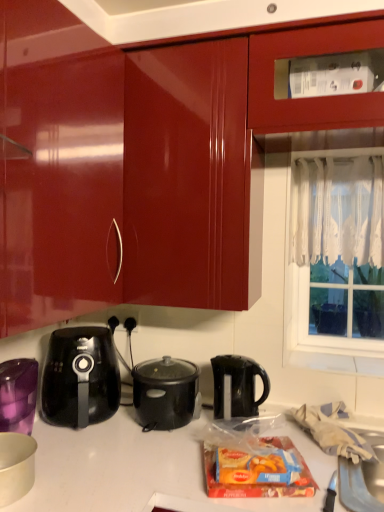
Image resolution: width=384 pixels, height=512 pixels. I want to click on white lace curtain at right, so click(x=334, y=252).

The height and width of the screenshot is (512, 384). Identify the location of matte plastic cereal at lower center. (259, 484).

This screenshot has height=512, width=384. What are the coordinates of `white matte bowl at lower left, which is counted as the 2th kitchen appliance, starting from the back` in the screenshot? It's located at (x=16, y=466).

The width and height of the screenshot is (384, 512). I want to click on black plastic kettle at center, the 1th kettle in the right-to-left sequence, so click(x=238, y=384).

What are the coordinates of `black plastic kettle at lower left, acting as the first kettle starting from the left` in the screenshot? It's located at click(80, 377).

How much distance is there between black plastic kettle at lower left, acting as the first kettle starting from the left, and black plastic kettle at center, the 1th kettle in the right-to-left sequence?

black plastic kettle at lower left, acting as the first kettle starting from the left, is 18.43 inches away from black plastic kettle at center, the 1th kettle in the right-to-left sequence.

Which object is further away from the camera taking this photo, black plastic kettle at lower left, acting as the first kettle starting from the left, or black plastic kettle at center, which is counted as the second kettle, starting from the left?

Positioned behind is black plastic kettle at center, which is counted as the second kettle, starting from the left.

Between black plastic kettle at lower left, acting as the first kettle starting from the left, and black plastic kettle at center, which is counted as the second kettle, starting from the left, which one has smaller width?

black plastic kettle at center, which is counted as the second kettle, starting from the left, is thinner.

The width and height of the screenshot is (384, 512). Find the location of `kettle on the right of black plastic kettle at lower left, the second kettle positioned from the right`. kettle on the right of black plastic kettle at lower left, the second kettle positioned from the right is located at coordinates (238, 384).

Is white lace curtain at right looking in the opposite direction of glossy wood cabinet at upper center?

white lace curtain at right does not have its back to glossy wood cabinet at upper center.

Which object is positioned more to the right, white lace curtain at right or glossy wood cabinet at upper center?

white lace curtain at right.

Is glossy wood cabinet at upper center located within white lace curtain at right?

That's incorrect, glossy wood cabinet at upper center is not inside white lace curtain at right.

Can we say black plastic outlet at center lies outside white lace curtain at right?

Absolutely, black plastic outlet at center is external to white lace curtain at right.

In the scene shown: Is black plastic outlet at center next to white lace curtain at right?

There is a gap between black plastic outlet at center and white lace curtain at right.

Is the depth of black plastic outlet at center greater than that of white lace curtain at right?

Yes.

Is black plastic slow cooker at center, which is the 2th kitchen appliance in front-to-back order, positioned beyond the bounds of black plastic kettle at center, which is counted as the second kettle, starting from the left?

Absolutely, black plastic slow cooker at center, which is the 2th kitchen appliance in front-to-back order, is external to black plastic kettle at center, which is counted as the second kettle, starting from the left.

Is black plastic slow cooker at center, the first kitchen appliance positioned from the back, wider or thinner than black plastic kettle at center, which is counted as the second kettle, starting from the left?

In the image, black plastic slow cooker at center, the first kitchen appliance positioned from the back, appears to be wider than black plastic kettle at center, which is counted as the second kettle, starting from the left.

How many degrees apart are the facing directions of black plastic slow cooker at center, which ranks as the 2th kitchen appliance in left-to-right order, and black plastic kettle at center, which is counted as the second kettle, starting from the left?

The angle between the facing direction of black plastic slow cooker at center, which ranks as the 2th kitchen appliance in left-to-right order, and the facing direction of black plastic kettle at center, which is counted as the second kettle, starting from the left, is 7.94 degrees.

Where is `kettle below the black plastic slow cooker at center, which ranks as the 2th kitchen appliance in left-to-right order (from the image's perspective)`? This screenshot has width=384, height=512. kettle below the black plastic slow cooker at center, which ranks as the 2th kitchen appliance in left-to-right order (from the image's perspective) is located at coordinates (238, 384).

Can you confirm if black plastic outlet at center is positioned to the right of matte plastic cereal at lower center?

Incorrect, black plastic outlet at center is not on the right side of matte plastic cereal at lower center.

Which of these two, black plastic outlet at center or matte plastic cereal at lower center, is thinner?

black plastic outlet at center is thinner.

Considering the sizes of objects black plastic outlet at center and matte plastic cereal at lower center in the image provided, who is bigger, black plastic outlet at center or matte plastic cereal at lower center?

matte plastic cereal at lower center is bigger.

From a real-world perspective, which object rests below the other?

matte plastic cereal at lower center, from a real-world perspective.

Considering the points (314, 165) and (199, 400), which point is behind, point (314, 165) or point (199, 400)?

The point (314, 165) is behind.

Where is `kitchen appliance that is the 1st object directly below the white lace curtain at right (from a real-world perspective)`? kitchen appliance that is the 1st object directly below the white lace curtain at right (from a real-world perspective) is located at coordinates (165, 393).

Which object is thinner, white lace curtain at right or black plastic slow cooker at center, placed as the first kitchen appliance when sorted from right to left?

Thinner between the two is white lace curtain at right.

Is white lace curtain at right turned away from black plastic slow cooker at center, the first kitchen appliance positioned from the back?

white lace curtain at right does not have its back to black plastic slow cooker at center, the first kitchen appliance positioned from the back.

Consider the image. Considering the relative sizes of black plastic kettle at lower left, acting as the first kettle starting from the left, and black plastic outlet at center in the image provided, is black plastic kettle at lower left, acting as the first kettle starting from the left, thinner than black plastic outlet at center?

In fact, black plastic kettle at lower left, acting as the first kettle starting from the left, might be wider than black plastic outlet at center.

Looking at this image, considering the sizes of objects black plastic kettle at lower left, acting as the first kettle starting from the left, and black plastic outlet at center in the image provided, who is bigger, black plastic kettle at lower left, acting as the first kettle starting from the left, or black plastic outlet at center?

black plastic kettle at lower left, acting as the first kettle starting from the left, is bigger.

Can you tell me how much black plastic kettle at lower left, acting as the first kettle starting from the left, and black plastic outlet at center differ in facing direction?

The angle between the facing direction of black plastic kettle at lower left, acting as the first kettle starting from the left, and the facing direction of black plastic outlet at center is 96.6 degrees.

In the scene shown: Is black plastic kettle at lower left, acting as the first kettle starting from the left, placed right next to black plastic outlet at center?

No, black plastic kettle at lower left, acting as the first kettle starting from the left, is not touching black plastic outlet at center.

Find the location of `kettle that is under the black plastic kettle at lower left, the second kettle positioned from the right (from a real-world perspective)`. kettle that is under the black plastic kettle at lower left, the second kettle positioned from the right (from a real-world perspective) is located at coordinates (238, 384).

What are the coordinates of `cabinetry to the left of white lace curtain at right` in the screenshot? It's located at (136, 166).

From the picture: When comparing their distances from white lace curtain at right, does matte plastic cereal at lower center or black plastic kettle at lower left, the second kettle positioned from the right, seem closer?

Based on the image, matte plastic cereal at lower center appears to be nearer to white lace curtain at right.

Which object lies further to the anchor point white matte bowl at lower left, the 1th kitchen appliance viewed from the left, white lace curtain at window right or black plastic slow cooker at center, placed as the first kitchen appliance when sorted from right to left?

white lace curtain at window right is positioned further to the anchor white matte bowl at lower left, the 1th kitchen appliance viewed from the left.

From the picture: Considering their positions, is black plastic outlet at center positioned further to white lace curtain at window right than black plastic slow cooker at center, which ranks as the 2th kitchen appliance in left-to-right order?

black plastic outlet at center is further to white lace curtain at window right.

From the image, which object appears to be nearer to glossy wood cabinet at upper center, black plastic kettle at lower left, the second kettle positioned from the right, or white lace curtain at window right?

Among the two, black plastic kettle at lower left, the second kettle positioned from the right, is located nearer to glossy wood cabinet at upper center.

From the image, which object appears to be nearer to white lace curtain at right, black plastic kettle at center, the 1th kettle in the right-to-left sequence, or black plastic outlet at center?

black plastic kettle at center, the 1th kettle in the right-to-left sequence, is closer to white lace curtain at right.

Looking at the image, which one is located closer to black plastic slow cooker at center, which is the 2th kitchen appliance in front-to-back order, black plastic kettle at center, which is counted as the second kettle, starting from the left, or matte plastic cereal at lower center?

The object closer to black plastic slow cooker at center, which is the 2th kitchen appliance in front-to-back order, is black plastic kettle at center, which is counted as the second kettle, starting from the left.

When comparing their distances from white lace curtain at window right, does matte plastic cereal at lower center or black plastic slow cooker at center, which ranks as the 2th kitchen appliance in left-to-right order, seem further?

matte plastic cereal at lower center is positioned further to the anchor white lace curtain at window right.

Which object lies further to the anchor point matte plastic cereal at lower center, black plastic kettle at lower left, acting as the first kettle starting from the left, or black plastic outlet at center?

black plastic outlet at center is positioned further to the anchor matte plastic cereal at lower center.

This screenshot has width=384, height=512. I want to click on kettle between black plastic kettle at lower left, the second kettle positioned from the right, and white lace curtain at right, in the horizontal direction, so click(x=238, y=384).

I want to click on kitchen appliance situated between black plastic outlet at center and white lace curtain at right from left to right, so click(x=165, y=393).

Locate an element on the screen. The image size is (384, 512). cabinetry between black plastic kettle at lower left, acting as the first kettle starting from the left, and white lace curtain at right is located at coordinates (136, 166).

Find the location of `kitchen appliance situated between black plastic kettle at lower left, acting as the first kettle starting from the left, and matte plastic cereal at lower center from left to right`. kitchen appliance situated between black plastic kettle at lower left, acting as the first kettle starting from the left, and matte plastic cereal at lower center from left to right is located at coordinates (165, 393).